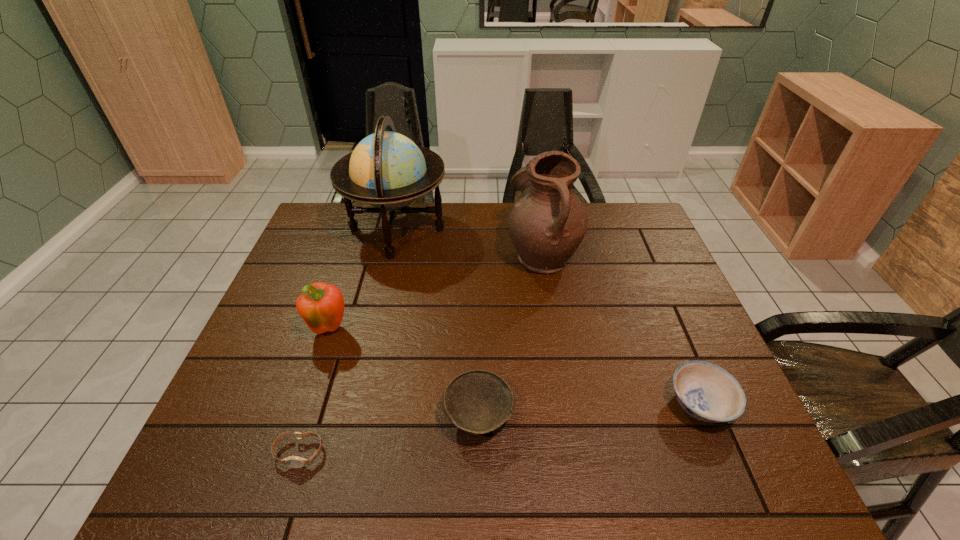
The height and width of the screenshot is (540, 960). I want to click on vacant space at the far left corner, so click(312, 231).

This screenshot has height=540, width=960. What are the coordinates of `free space at the far right corner of the desktop` in the screenshot? It's located at (639, 231).

Locate an element on the screen. The height and width of the screenshot is (540, 960). free space between the taller bowl and the third tallest object is located at coordinates (404, 373).

Locate an element on the screen. This screenshot has height=540, width=960. free space between the rightmost object and the third shortest object is located at coordinates (589, 410).

The image size is (960, 540). Identify the location of blank region between the fifth object from left to right and the third shortest object. (511, 335).

You are a GUI agent. You are given a task and a screenshot of the screen. Output one action in this format:
    pyautogui.click(x=<x>, y=<y>)
    Task: Click on the blank region between the pepper and the rightmost object
    This screenshot has width=960, height=540.
    Given the screenshot: What is the action you would take?
    pyautogui.click(x=516, y=367)

Identify the location of free spot between the rightmost object and the pitcher. The image size is (960, 540). (621, 329).

The width and height of the screenshot is (960, 540). Identify the location of free space between the shortest object and the globe. (348, 341).

At what (x,y) coordinates should I click in order to perform the action: click on vacant space that is in between the pitcher and the pepper. Please return your answer as a coordinate pair (x, y). The width and height of the screenshot is (960, 540). Looking at the image, I should click on (437, 292).

What are the coordinates of `vacant area that lies between the left bowl and the fourth shortest object` in the screenshot? It's located at (404, 373).